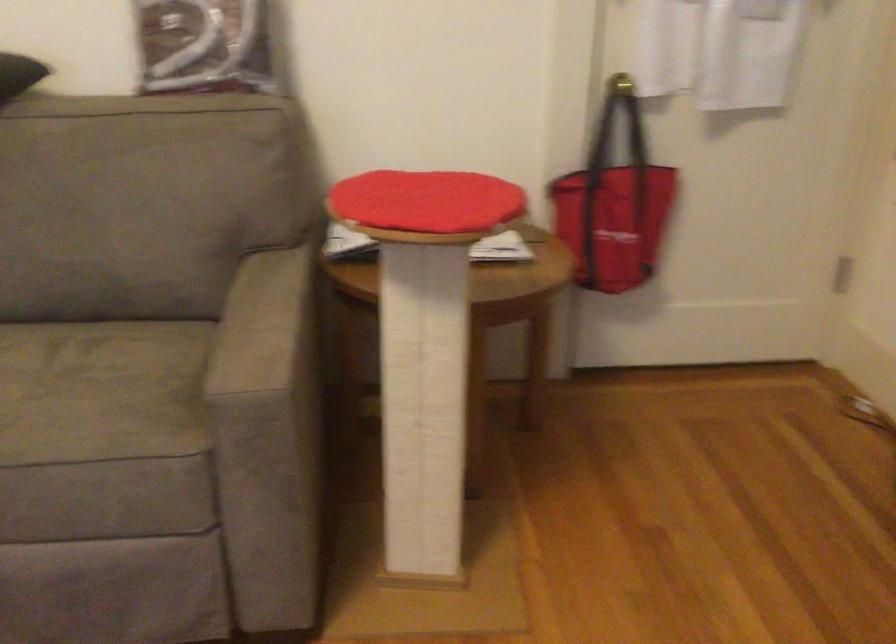
Find where to sit the grey sofa surface. Please return your answer as a coordinate pair (x, y).

(101, 391)